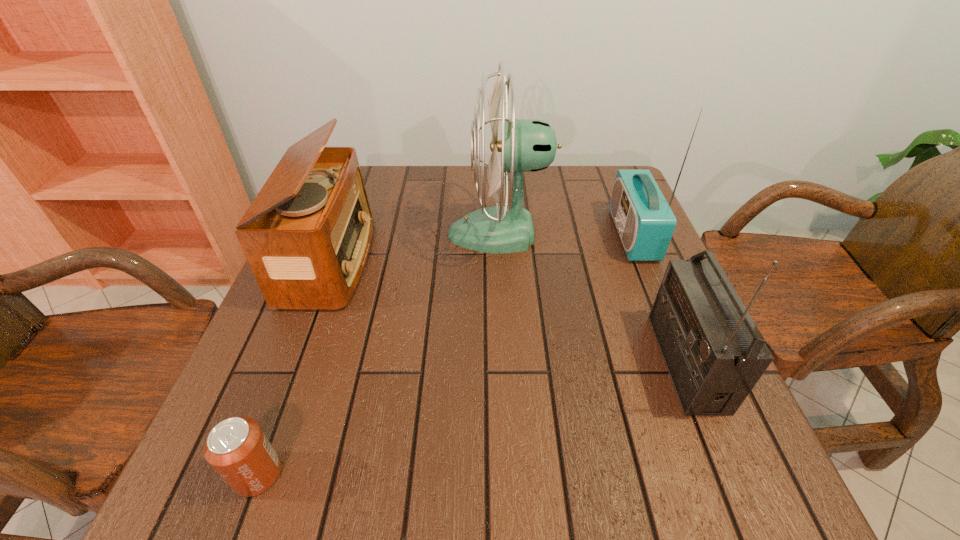
Identify the location of vacant area between the second shortest object and the nearest radio receiver. (509, 312).

Image resolution: width=960 pixels, height=540 pixels. I want to click on vacant space that is in between the second shortest object and the fan, so click(416, 247).

Image resolution: width=960 pixels, height=540 pixels. Find the location of `free spot between the third object from left to right and the shortest radio receiver`. free spot between the third object from left to right and the shortest radio receiver is located at coordinates (416, 247).

At what (x,y) coordinates should I click in order to perform the action: click on vacant region between the shortest radio receiver and the can. Please return your answer as a coordinate pair (x, y). Looking at the image, I should click on (295, 368).

The image size is (960, 540). In order to click on object that stands as the third closest to the fan in this screenshot , I will do `click(715, 354)`.

Where is `object that ranks as the second closest to the third object from right to left`? This screenshot has height=540, width=960. object that ranks as the second closest to the third object from right to left is located at coordinates (307, 234).

Identify the location of the second closest radio receiver to the shortest radio receiver. (715, 354).

At what (x,y) coordinates should I click in order to perform the action: click on radio receiver that is the second closest to the fourth tallest object. Please return your answer as a coordinate pair (x, y). The height and width of the screenshot is (540, 960). Looking at the image, I should click on (715, 354).